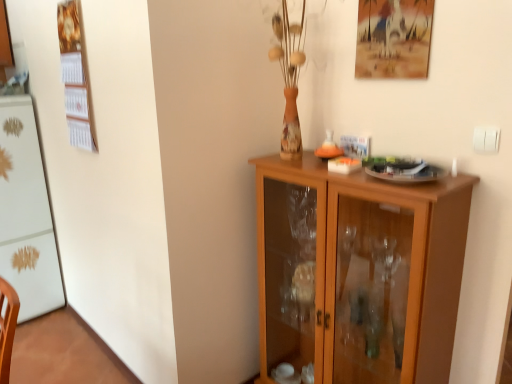
Question: Is matte wooden picture frame at upper right oriented towards white glossy refrigerator at left?

Choices:
 (A) yes
 (B) no

Answer: (B)

Question: Does matte wooden picture frame at upper right appear on the right side of white glossy refrigerator at left?

Choices:
 (A) yes
 (B) no

Answer: (A)

Question: Is matte wooden picture frame at upper right looking in the opposite direction of white glossy refrigerator at left?

Choices:
 (A) no
 (B) yes

Answer: (A)

Question: Is matte wooden picture frame at upper right thinner than white glossy refrigerator at left?

Choices:
 (A) no
 (B) yes

Answer: (B)

Question: Considering the relative sizes of matte wooden picture frame at upper right and white glossy refrigerator at left in the image provided, is matte wooden picture frame at upper right bigger than white glossy refrigerator at left?

Choices:
 (A) yes
 (B) no

Answer: (B)

Question: Are matte wooden picture frame at upper right and white glossy refrigerator at left located far from each other?

Choices:
 (A) no
 (B) yes

Answer: (B)

Question: Could you tell me if wooden cabinet at center is facing matte wooden picture frame at upper right?

Choices:
 (A) yes
 (B) no

Answer: (B)

Question: Is wooden cabinet at center beside matte wooden picture frame at upper right?

Choices:
 (A) no
 (B) yes

Answer: (A)

Question: From the image's perspective, is wooden cabinet at center under matte wooden picture frame at upper right?

Choices:
 (A) no
 (B) yes

Answer: (B)

Question: Can you confirm if wooden cabinet at center is positioned to the left of matte wooden picture frame at upper right?

Choices:
 (A) no
 (B) yes

Answer: (B)

Question: Considering the relative sizes of wooden cabinet at center and matte wooden picture frame at upper right in the image provided, is wooden cabinet at center smaller than matte wooden picture frame at upper right?

Choices:
 (A) no
 (B) yes

Answer: (A)

Question: From a real-world perspective, does wooden cabinet at center stand above matte wooden picture frame at upper right?

Choices:
 (A) no
 (B) yes

Answer: (A)

Question: From the image's perspective, is white glossy refrigerator at left above wooden cabinet at center?

Choices:
 (A) no
 (B) yes

Answer: (B)